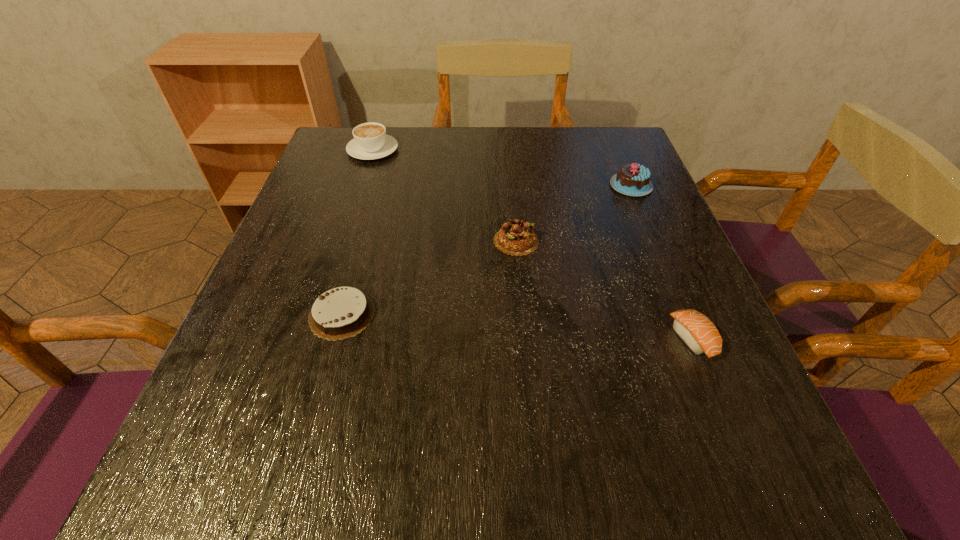
Locate an element on the screen. This screenshot has height=540, width=960. empty location between the second shortest chocolate cake and the sushi is located at coordinates (604, 290).

At what (x,y) coordinates should I click in order to perform the action: click on empty location between the shortest chocolate cake and the farthest object. Please return your answer as a coordinate pair (x, y). The width and height of the screenshot is (960, 540). Looking at the image, I should click on (357, 232).

Identify the location of vacant point located between the rightmost chocolate cake and the third farthest object. The image size is (960, 540). (573, 213).

Locate an element on the screen. This screenshot has width=960, height=540. vacant area that lies between the shortest chocolate cake and the sushi is located at coordinates (517, 327).

Where is `vacant space in between the nearest chocolate cake and the farthest chocolate cake`? vacant space in between the nearest chocolate cake and the farthest chocolate cake is located at coordinates (487, 250).

This screenshot has height=540, width=960. In order to click on free space between the cappuccino and the leftmost chocolate cake in this screenshot , I will do `click(357, 232)`.

Identify which object is the nearest to the nearest chocolate cake. Please provide its 2D coordinates. Your answer should be formatted as a tuple, i.e. [(x, y)], where the tuple contains the x and y coordinates of a point satisfying the conditions above.

[(516, 237)]

Identify the location of object identified as the third closest to the tallest chocolate cake. (370, 141).

Point out which chocolate cake is positioned as the nearest to the third object from left to right. Please provide its 2D coordinates. Your answer should be formatted as a tuple, i.e. [(x, y)], where the tuple contains the x and y coordinates of a point satisfying the conditions above.

[(632, 179)]

The image size is (960, 540). Find the location of `chocolate cake that can be found as the third closest to the sushi`. chocolate cake that can be found as the third closest to the sushi is located at coordinates (343, 312).